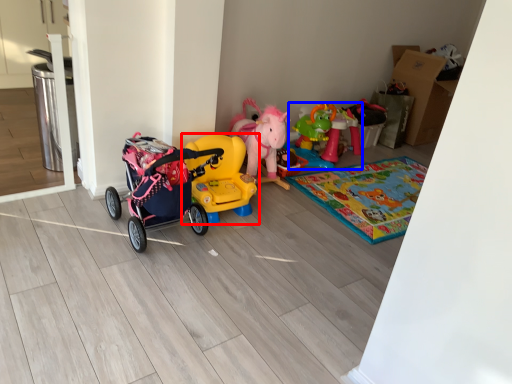
Question: Which of the following is the farthest to the observer, toy (highlighted by a red box) or toy (highlighted by a blue box)?

Choices:
 (A) toy
 (B) toy

Answer: (B)